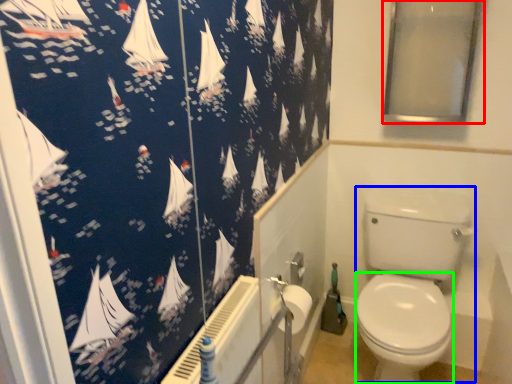
Question: Which object is positioned closest to window screen (highlighted by a red box)? Select from toilet bowl (highlighted by a blue box) and bidet (highlighted by a green box).

Choices:
 (A) toilet bowl
 (B) bidet

Answer: (A)